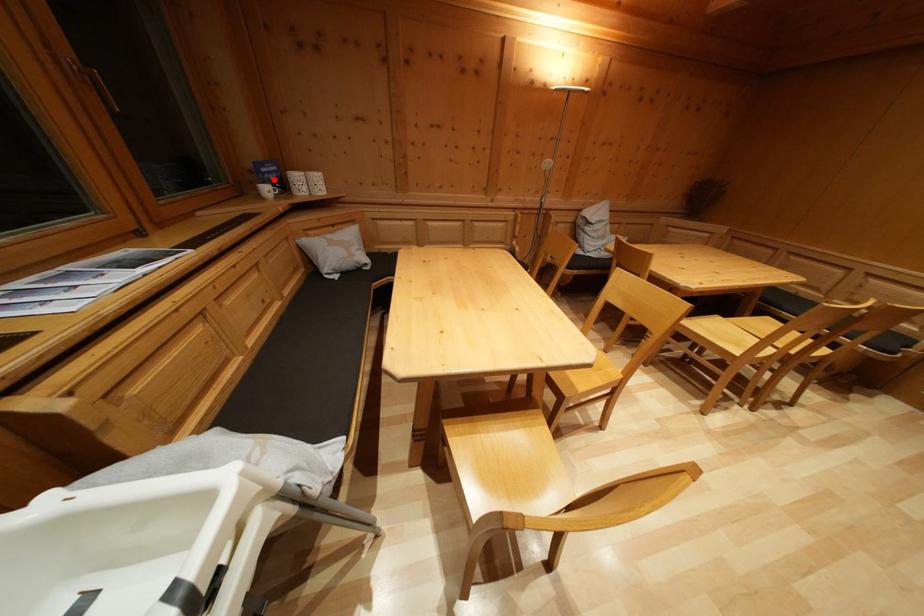
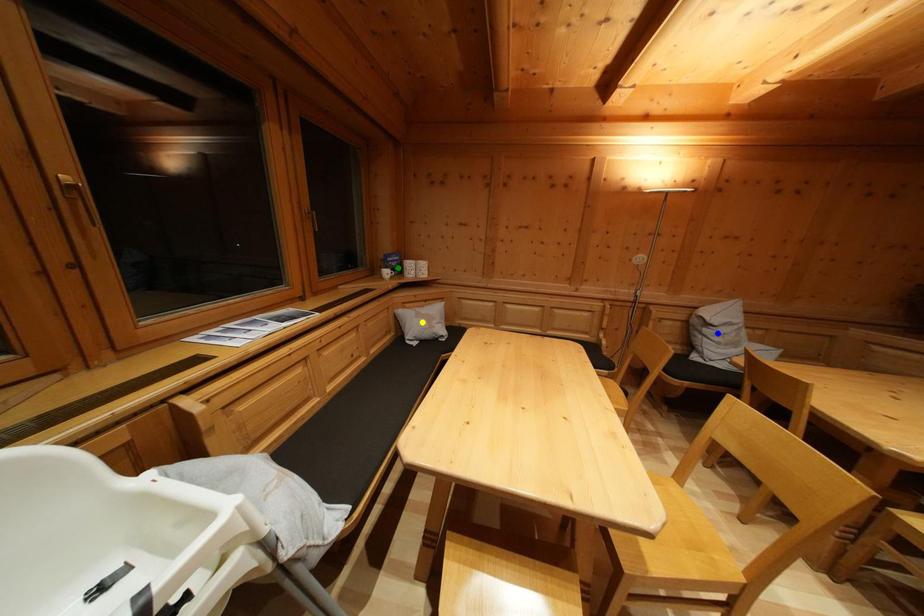
Question: I am providing you with two images of the same scene from different viewpoints. A red point is marked on the first image. You are given multiple points on the second image. In image 2, which mark is for the same physical point as the one in image 1?

Choices:
 (A) yellow point
 (B) blue point
 (C) green point

Answer: (C)